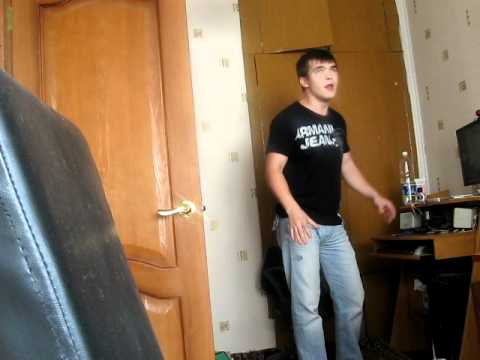
This screenshot has height=360, width=480. Identify the location of wall. (226, 234), (455, 84).